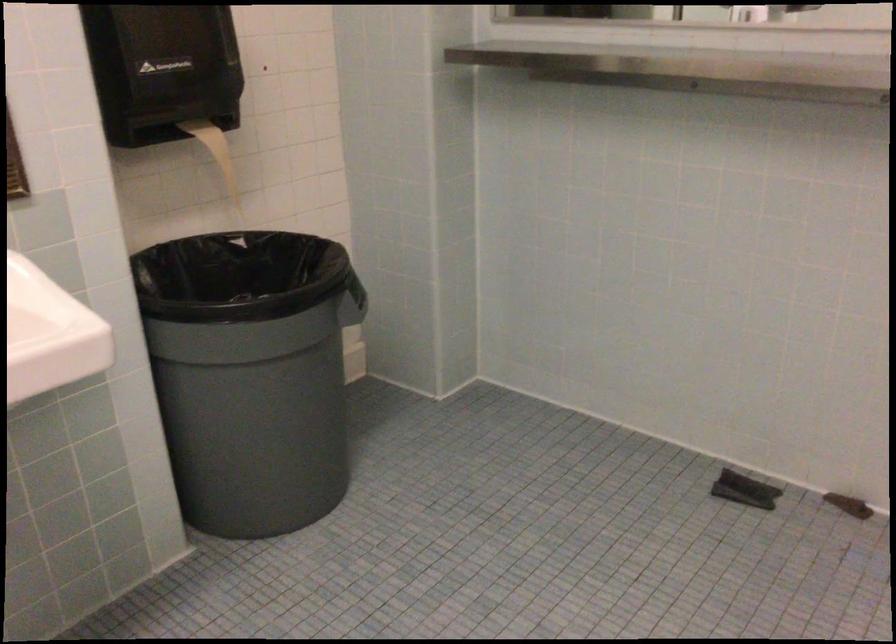
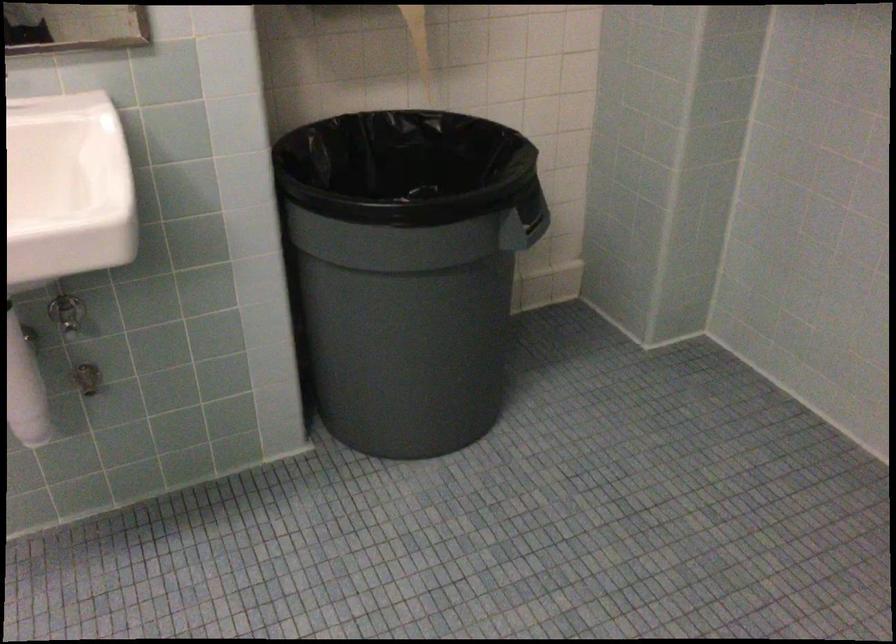
In the second image, find the point that corresponds to (554,468) in the first image.

(745, 469)